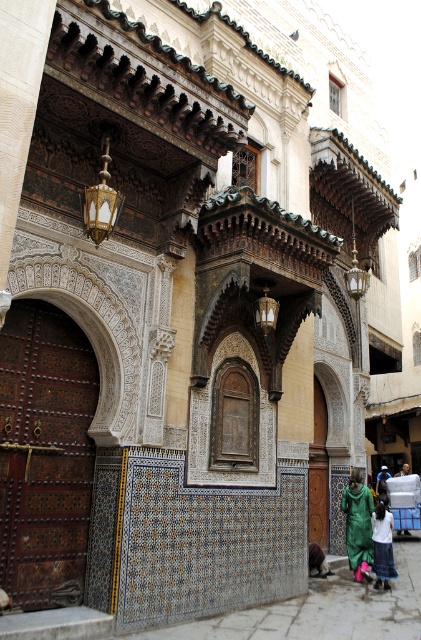
You are standing in front of the Moroccan architectural structure and see the green fabric person at lower right and the dark green fabric at lower center. Which object is positioned more to the left?

The green fabric person at lower right is positioned more to the left than the dark green fabric at lower center.